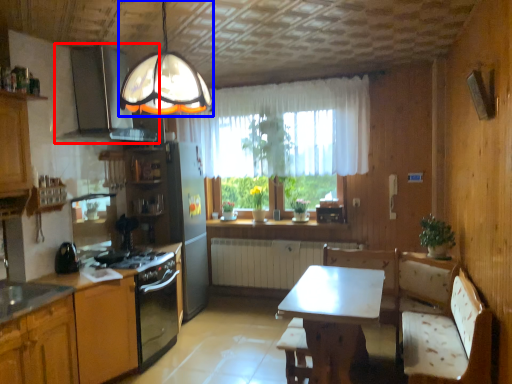
Question: Which object appears closest to the camera in this image, exhaust hood (highlighted by a red box) or lamp (highlighted by a blue box)?

Choices:
 (A) exhaust hood
 (B) lamp

Answer: (B)